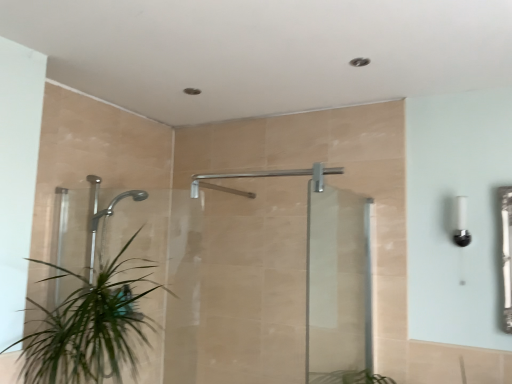
Question: Is green leafy plant at lower left surrounded by silver metallic shower at center?

Choices:
 (A) no
 (B) yes

Answer: (A)

Question: Can you confirm if silver metallic shower at center is smaller than green leafy plant at lower left?

Choices:
 (A) yes
 (B) no

Answer: (A)

Question: Would you say silver metallic shower at center is a long distance from green leafy plant at lower left?

Choices:
 (A) no
 (B) yes

Answer: (B)

Question: Is silver metallic shower at center facing towards green leafy plant at lower left?

Choices:
 (A) no
 (B) yes

Answer: (A)

Question: Considering the relative sizes of silver metallic shower at center and green leafy plant at lower left in the image provided, is silver metallic shower at center thinner than green leafy plant at lower left?

Choices:
 (A) no
 (B) yes

Answer: (B)

Question: Looking at the image, does transparent glass screen door at center, arranged as the first screen door when viewed from the right, seem bigger or smaller compared to green leafy plant at lower left?

Choices:
 (A) big
 (B) small

Answer: (B)

Question: From their relative heights in the image, would you say transparent glass screen door at center, arranged as the first screen door when viewed from the right, is taller or shorter than green leafy plant at lower left?

Choices:
 (A) tall
 (B) short

Answer: (A)

Question: From a real-world perspective, is transparent glass screen door at center, acting as the 2th screen door starting from the left, physically located above or below green leafy plant at lower left?

Choices:
 (A) above
 (B) below

Answer: (A)

Question: In the image, is transparent glass screen door at center, arranged as the first screen door when viewed from the right, on the left side or the right side of green leafy plant at lower left?

Choices:
 (A) right
 (B) left

Answer: (A)

Question: Is silver metallic shower at center bigger or smaller than white glossy light fixture at right?

Choices:
 (A) small
 (B) big

Answer: (B)

Question: Does point (192, 185) appear closer or farther from the camera than point (457, 226)?

Choices:
 (A) farther
 (B) closer

Answer: (A)

Question: Relative to white glossy light fixture at right, is silver metallic shower at center in front or behind?

Choices:
 (A) front
 (B) behind

Answer: (B)

Question: Is silver metallic shower at center wider or thinner than white glossy light fixture at right?

Choices:
 (A) wide
 (B) thin

Answer: (B)

Question: In terms of height, does green leafy plant at lower left look taller or shorter compared to silver metallic shower at center?

Choices:
 (A) short
 (B) tall

Answer: (B)

Question: Looking at their shapes, would you say green leafy plant at lower left is wider or thinner than silver metallic shower at center?

Choices:
 (A) thin
 (B) wide

Answer: (B)